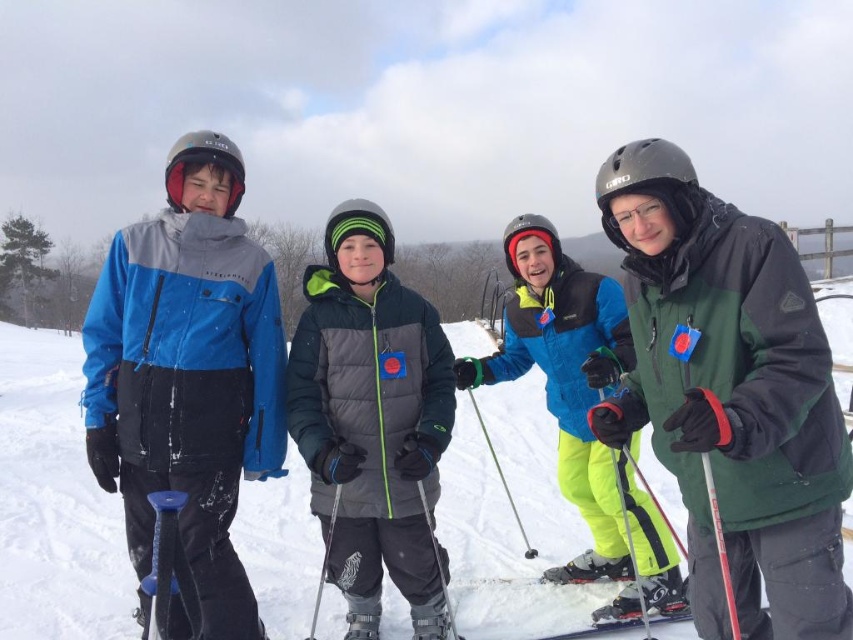
Which is in front, point (107, 342) or point (549, 376)?

Point (107, 342) is in front.

Does blue matte ski jacket at left come behind neon yellow ski pants at center?

No, it is in front of neon yellow ski pants at center.

Describe the element at coordinates (189, 372) in the screenshot. I see `blue matte ski jacket at left` at that location.

Locate an element on the screen. The width and height of the screenshot is (853, 640). blue matte ski jacket at left is located at coordinates (189, 372).

Is point (699, 202) positioned before point (236, 243)?

Yes, it is in front of point (236, 243).

Is point (747, 385) more distant than point (180, 228)?

No.

Is point (764, 380) more distant than point (245, 451)?

No.

The width and height of the screenshot is (853, 640). What are the coordinates of `green matte jacket at center` in the screenshot? It's located at pos(730,394).

You are a GUI agent. You are given a task and a screenshot of the screen. Output one action in this format:
    pyautogui.click(x=<x>, y=<y>)
    Task: Click on the green matte jacket at center
    
    Given the screenshot: What is the action you would take?
    click(x=730, y=394)

Does green matte jacket at center appear on the right side of neon yellow ski pants at center?

Yes, green matte jacket at center is to the right of neon yellow ski pants at center.

Between point (648, 419) and point (553, 416), which one is positioned in front?

Point (648, 419) is in front.

Identify the location of green matte jacket at center. (730, 394).